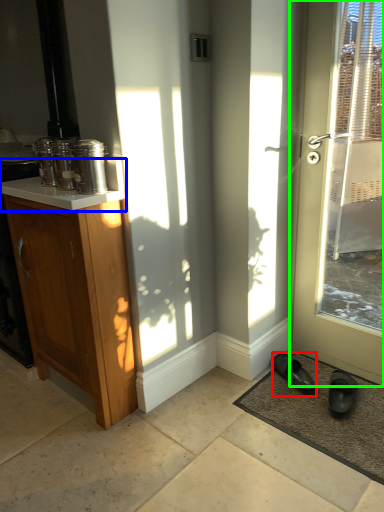
Question: Which object is the closest to the footwear (highlighted by a red box)? Choose among these: counter top (highlighted by a blue box) or door (highlighted by a green box).

Choices:
 (A) counter top
 (B) door

Answer: (B)